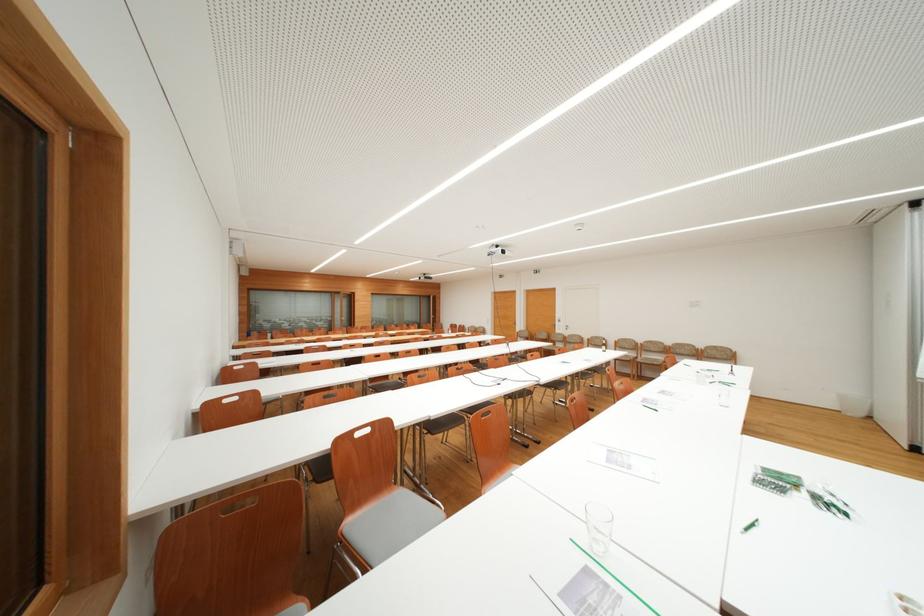
The image size is (924, 616). I want to click on chair back handle, so click(235, 504).